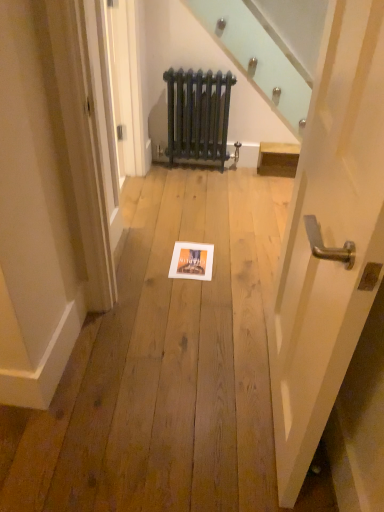
What do you see at coordinates (198, 115) in the screenshot?
I see `dark blue cast iron radiator at center` at bounding box center [198, 115].

This screenshot has height=512, width=384. What do you see at coordinates (329, 238) in the screenshot? I see `white glossy door handle at center right` at bounding box center [329, 238].

I want to click on dark blue cast iron radiator at center, so 198,115.

Consider the image. Relative to dark blue cast iron radiator at center, is matte white picture frame at center in front or behind?

matte white picture frame at center is in front of dark blue cast iron radiator at center.

From a real-world perspective, which is physically below, matte white picture frame at center or dark blue cast iron radiator at center?

matte white picture frame at center is physically lower.

Is matte white picture frame at center far from dark blue cast iron radiator at center?

Yes, matte white picture frame at center and dark blue cast iron radiator at center are quite far apart.

From the image's perspective, relative to matte white picture frame at center, is dark blue cast iron radiator at center above or below?

From the image's perspective, dark blue cast iron radiator at center appears above matte white picture frame at center.

Would you consider dark blue cast iron radiator at center to be distant from matte white picture frame at center?

Absolutely, dark blue cast iron radiator at center is distant from matte white picture frame at center.

Can you confirm if dark blue cast iron radiator at center is taller than matte white picture frame at center?

Yes.

Is dark blue cast iron radiator at center turned away from matte white picture frame at center?

That's not correct — dark blue cast iron radiator at center is not looking away from matte white picture frame at center.

Is white glossy door handle at center right closer to the viewer compared to matte white picture frame at center?

Yes, the depth of white glossy door handle at center right is less than that of matte white picture frame at center.

Which object is thinner, white glossy door handle at center right or matte white picture frame at center?

With smaller width is white glossy door handle at center right.

Is white glossy door handle at center right oriented towards matte white picture frame at center?

No, white glossy door handle at center right does not turn towards matte white picture frame at center.

Considering the relative positions of white glossy door handle at center right and dark blue cast iron radiator at center in the image provided, is white glossy door handle at center right in front of dark blue cast iron radiator at center?

Yes, it is.

Which of these two, white glossy door handle at center right or dark blue cast iron radiator at center, stands shorter?

dark blue cast iron radiator at center is shorter.

Between white glossy door handle at center right and dark blue cast iron radiator at center, which one has larger size?

Bigger between the two is white glossy door handle at center right.

From a real-world perspective, is white glossy door handle at center right on dark blue cast iron radiator at center?

Yes, from a real-world perspective, white glossy door handle at center right is on top of dark blue cast iron radiator at center.

Which is in front, point (166, 150) or point (354, 63)?

Point (354, 63)

From the image's perspective, who appears lower, dark blue cast iron radiator at center or white glossy door handle at center right?

white glossy door handle at center right.

Would you say dark blue cast iron radiator at center is a long distance from white glossy door handle at center right?

dark blue cast iron radiator at center is positioned a significant distance from white glossy door handle at center right.

Which object is further away from the camera taking this photo, dark blue cast iron radiator at center or white glossy door handle at center right?

Positioned behind is dark blue cast iron radiator at center.

Which of these two, matte white picture frame at center or white glossy door handle at center right, is thinner?

Thinner between the two is white glossy door handle at center right.

Does matte white picture frame at center have a greater height compared to white glossy door handle at center right?

No, matte white picture frame at center is not taller than white glossy door handle at center right.

In terms of size, does matte white picture frame at center appear bigger or smaller than white glossy door handle at center right?

Clearly, matte white picture frame at center is smaller in size than white glossy door handle at center right.

Is matte white picture frame at center positioned before white glossy door handle at center right?

No, matte white picture frame at center is further to the viewer.

I want to click on picture frame in front of the dark blue cast iron radiator at center, so click(192, 261).

Locate an element on the screen. radiator behind the matte white picture frame at center is located at coordinates (198, 115).

Estimate the real-world distances between objects in this image. Which object is further from matte white picture frame at center, dark blue cast iron radiator at center or white glossy door handle at center right?

Based on the image, dark blue cast iron radiator at center appears to be further to matte white picture frame at center.

From the image, which object appears to be nearer to dark blue cast iron radiator at center, white glossy door handle at center right or matte white picture frame at center?

matte white picture frame at center.

Considering their positions, is dark blue cast iron radiator at center positioned closer to white glossy door handle at center right than matte white picture frame at center?

matte white picture frame at center is closer to white glossy door handle at center right.

Which object lies nearer to the anchor point dark blue cast iron radiator at center, matte white picture frame at center or white glossy door handle at center right?

The object closer to dark blue cast iron radiator at center is matte white picture frame at center.

Estimate the real-world distances between objects in this image. Which object is closer to matte white picture frame at center, white glossy door handle at center right or dark blue cast iron radiator at center?

white glossy door handle at center right.

Considering their positions, is matte white picture frame at center positioned closer to white glossy door handle at center right than dark blue cast iron radiator at center?

The object closer to white glossy door handle at center right is matte white picture frame at center.

Locate an element on the screen. The image size is (384, 512). picture frame positioned between white glossy door handle at center right and dark blue cast iron radiator at center from near to far is located at coordinates (192, 261).